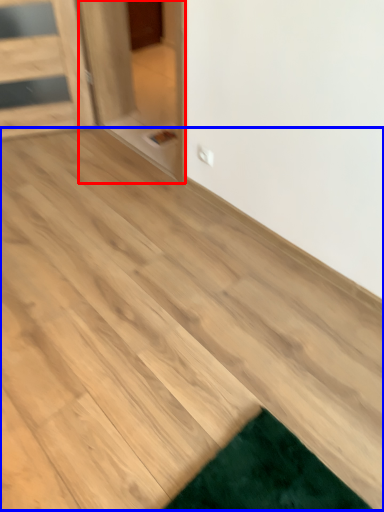
Question: Which of the following is the closest to the observer, glass door (highlighted by a red box) or plywood (highlighted by a blue box)?

Choices:
 (A) glass door
 (B) plywood

Answer: (B)